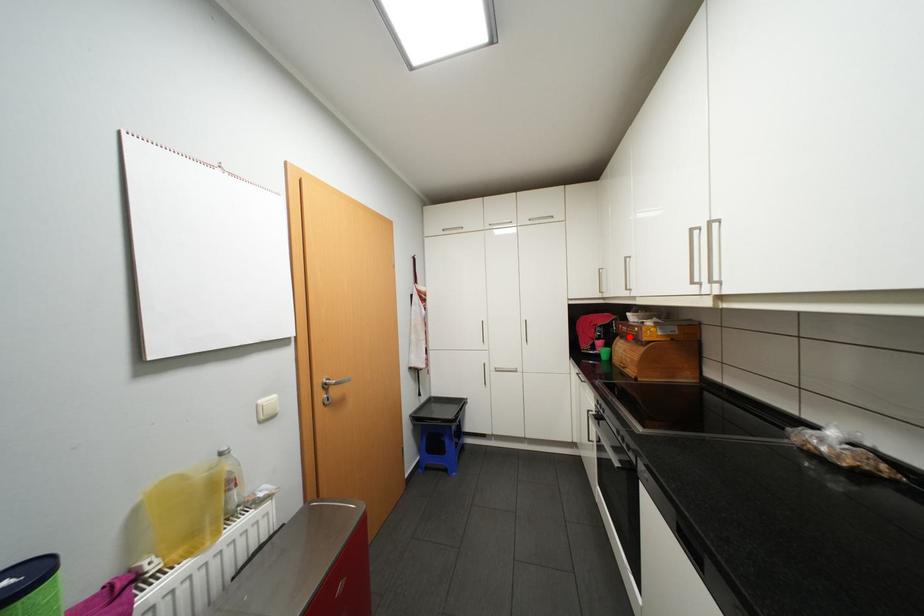
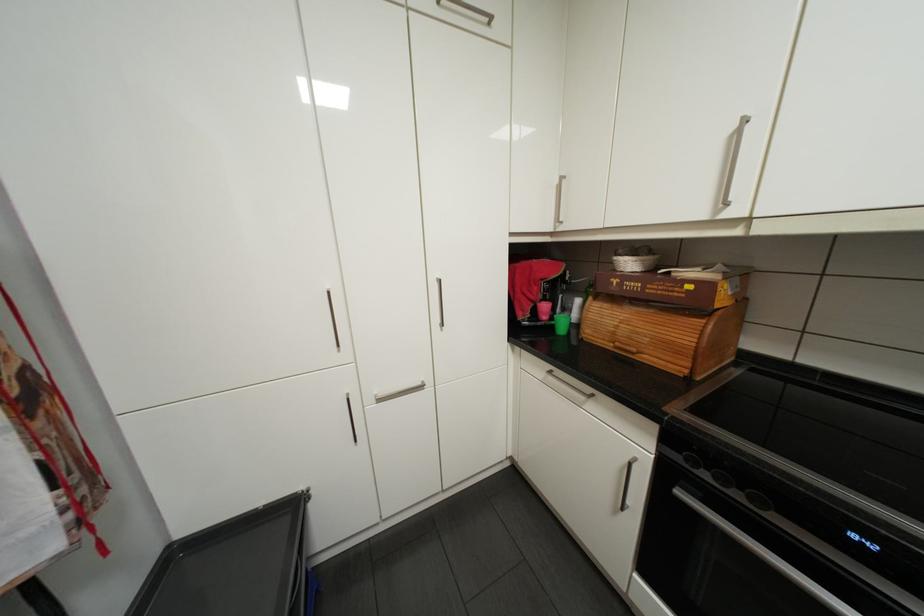
Question: I am providing you with two images of the same scene from different viewpoints. In image1, a red point is highlighted. Considering the same 3D point in image2, which of the following is correct?

Choices:
 (A) It is closer
 (B) It is farther

Answer: (A)